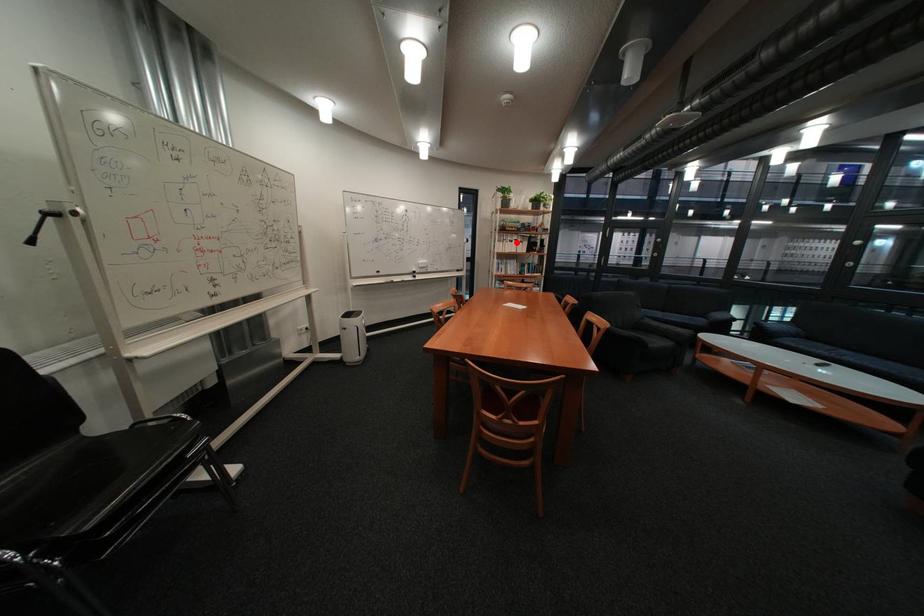
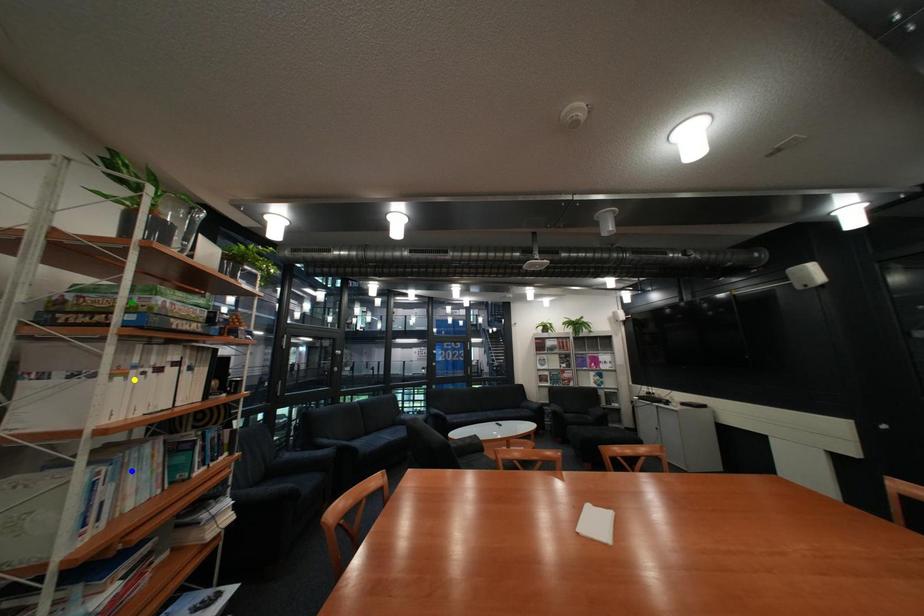
Question: I am providing you with two images of the same scene from different viewpoints. A red point is marked on the first image. You are given multiple points on the second image. In image 2, which mark is for the same physical point as the one in image 1?

Choices:
 (A) blue point
 (B) yellow point
 (C) green point

Answer: (B)